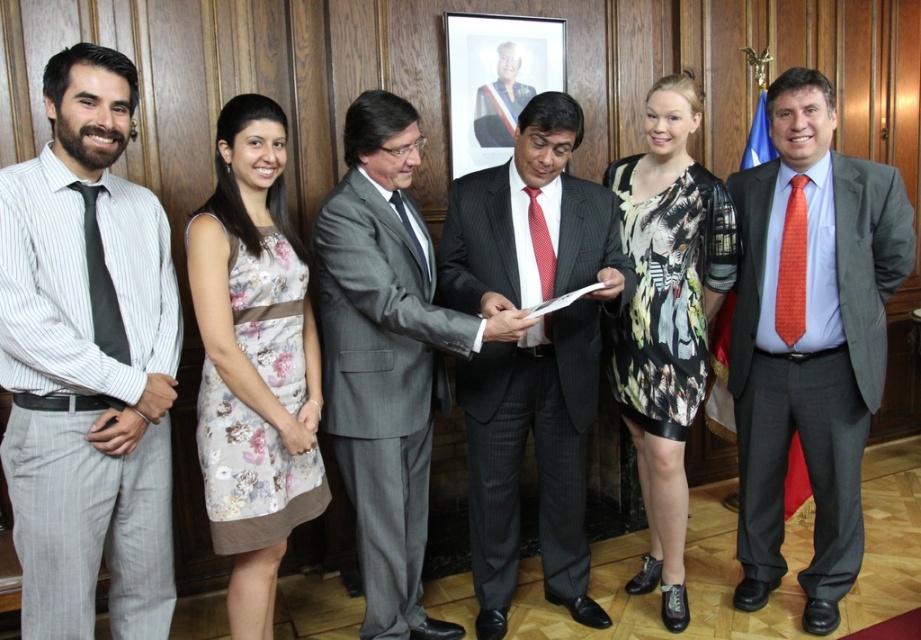
Question: Which of the following is the farthest from the observer?

Choices:
 (A) white paper at center
 (B) striped cotton shirt at left

Answer: (A)

Question: Among these points, which one is nearest to the camera?

Choices:
 (A) (257, 324)
 (B) (551, 285)
 (C) (509, 102)
 (D) (488, 387)

Answer: (A)

Question: Which point is closer to the camera taking this photo?

Choices:
 (A) (169, 604)
 (B) (305, 394)
 (C) (517, 336)

Answer: (A)

Question: Can you confirm if gray pinstripe suit at center is wider than orange dotted tie at right?

Choices:
 (A) yes
 (B) no

Answer: (A)

Question: Observing the image, what is the correct spatial positioning of floral fabric dress at center in reference to red dotted tie at center?

Choices:
 (A) above
 (B) below

Answer: (B)

Question: Does orange dotted tie at right appear on the left side of red dotted tie at center?

Choices:
 (A) no
 (B) yes

Answer: (A)